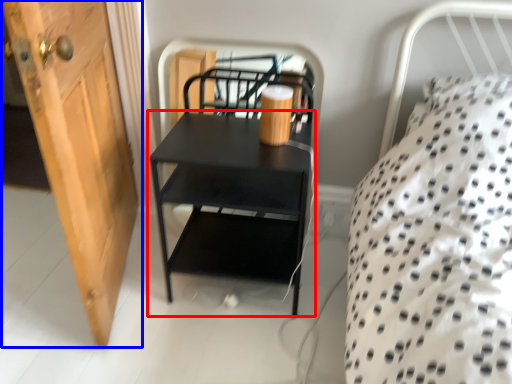
Question: Which object is closer to the camera taking this photo, nightstand (highlighted by a red box) or door (highlighted by a blue box)?

Choices:
 (A) nightstand
 (B) door

Answer: (B)